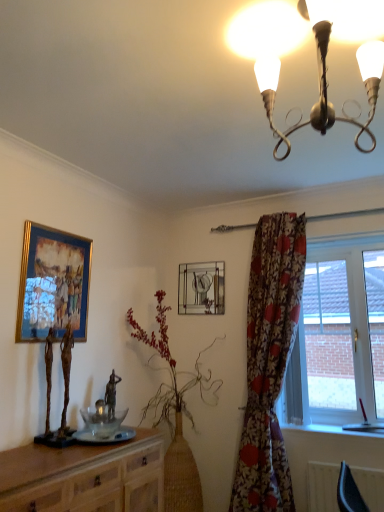
Question: Is wooden cabinet at lower left closer to the viewer compared to gold-framed painting at upper left, which appears as the first picture frame when viewed from the left?

Choices:
 (A) no
 (B) yes

Answer: (B)

Question: Does wooden cabinet at lower left have a greater width compared to gold-framed painting at upper left, which appears as the first picture frame when viewed from the front?

Choices:
 (A) yes
 (B) no

Answer: (A)

Question: Is wooden cabinet at lower left to the right of gold-framed painting at upper left, acting as the second picture frame starting from the right, from the viewer's perspective?

Choices:
 (A) no
 (B) yes

Answer: (B)

Question: Is wooden cabinet at lower left aimed at gold-framed painting at upper left, which appears as the first picture frame when viewed from the left?

Choices:
 (A) yes
 (B) no

Answer: (B)

Question: Is gold-framed painting at upper left, acting as the second picture frame starting from the right, surrounded by wooden cabinet at lower left?

Choices:
 (A) yes
 (B) no

Answer: (B)

Question: Is wooden cabinet at lower left next to gold-framed painting at upper left, which appears as the first picture frame when viewed from the left?

Choices:
 (A) yes
 (B) no

Answer: (B)

Question: Can you confirm if metallic chandelier at upper center is taller than floral fabric curtain at right?

Choices:
 (A) yes
 (B) no

Answer: (B)

Question: Does metallic chandelier at upper center have a smaller size compared to floral fabric curtain at right?

Choices:
 (A) yes
 (B) no

Answer: (A)

Question: Would you say floral fabric curtain at right is part of metallic chandelier at upper center's contents?

Choices:
 (A) no
 (B) yes

Answer: (A)

Question: Is metallic chandelier at upper center to the right of floral fabric curtain at right from the viewer's perspective?

Choices:
 (A) yes
 (B) no

Answer: (B)

Question: Does metallic chandelier at upper center appear on the left side of floral fabric curtain at right?

Choices:
 (A) no
 (B) yes

Answer: (B)

Question: Is floral fabric curtain at right at the back of metallic chandelier at upper center?

Choices:
 (A) yes
 (B) no

Answer: (B)

Question: From the image's perspective, is gold-framed painting at upper left, which appears as the first picture frame when viewed from the left, over floral fabric curtain at right?

Choices:
 (A) no
 (B) yes

Answer: (B)